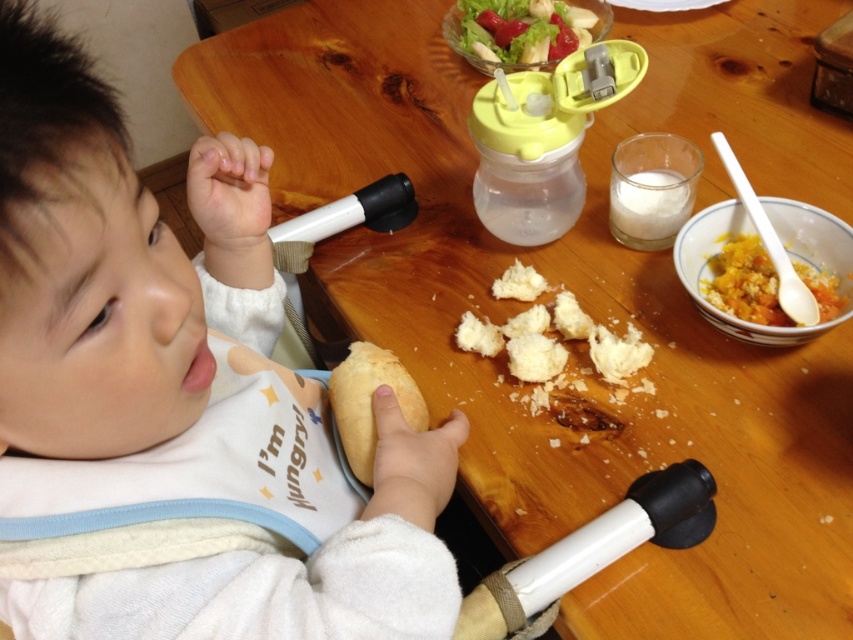
You are a parent trying to clean up after your child. You see the white fluffy bread crumbs at center and the fresh green lettuce at upper center on the table. Which item should you pick up first if you want to start with the one closest to the edge of the table?

The white fluffy bread crumbs at center is in front of the fresh green lettuce at upper center, meaning it is closer to the edge of the table. Therefore, you should pick up the white fluffy bread crumbs at center first.

You are a parent who wants to clean up the crumbs before they fall off the table. Which item should you clean first, the white soft bread at lower right or the white fluffy bread crumbs at center?

You should clean the white fluffy bread crumbs at center first because they are located above the white soft bread at lower right and might fall off the table sooner.

You are a parent trying to locate the white soft bread at lower right on the table. Can you confirm its exact location using coordinates?

The white soft bread at lower right is located at coordinates point (125, 278).